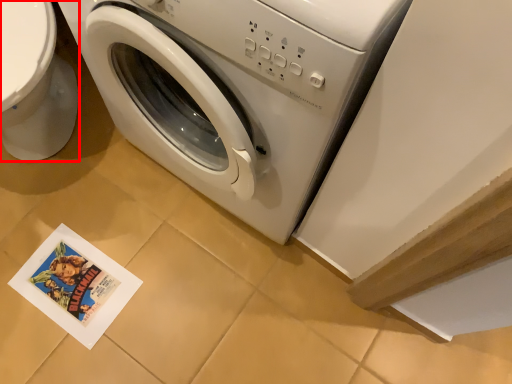
Question: From the image's perspective, considering the relative positions of toilet bowl (annotated by the red box) and washing machine in the image provided, where is toilet bowl (annotated by the red box) located with respect to the staircase?

Choices:
 (A) below
 (B) above

Answer: (B)